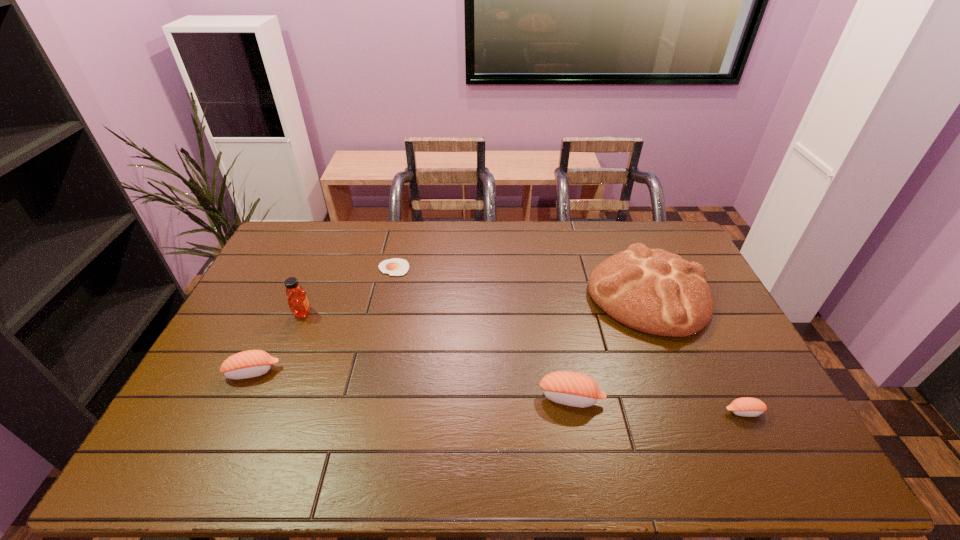
Locate an element on the screen. free space located 0.320m on the back of the third object from right to left is located at coordinates (554, 303).

This screenshot has width=960, height=540. Find the location of `vacant space located on the back of the shortest sushi`. vacant space located on the back of the shortest sushi is located at coordinates (714, 354).

Find the location of `vacant space located 0.190m on the back of the shortest object`. vacant space located 0.190m on the back of the shortest object is located at coordinates (402, 229).

Find the location of a particular element. free location located 0.180m on the front label of the honey is located at coordinates (369, 313).

The width and height of the screenshot is (960, 540). Identify the location of vacant space located 0.280m on the left of the bread. (503, 295).

In order to click on egg yolk that is at the far edge in this screenshot , I will do `click(394, 267)`.

Find the location of a particular element. The image size is (960, 540). bread located in the far edge section of the desktop is located at coordinates (656, 292).

This screenshot has height=540, width=960. What are the coordinates of `object that is at the left edge` in the screenshot? It's located at (252, 363).

Identify the location of sushi positioned at the right edge. (748, 407).

Find the location of a particular element. bread that is at the right edge is located at coordinates (656, 292).